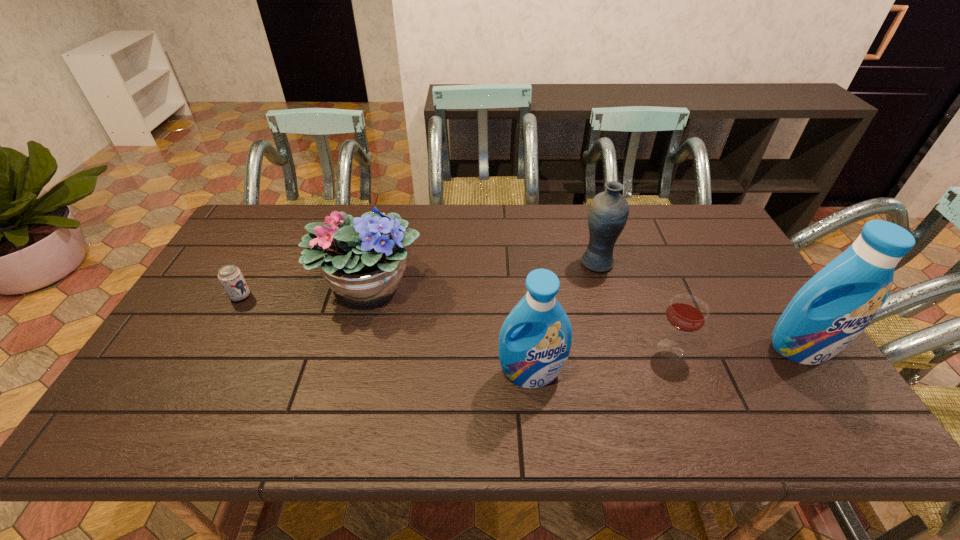
Where is `the left detergent`? This screenshot has width=960, height=540. the left detergent is located at coordinates (535, 339).

At what (x,y) coordinates should I click in order to perform the action: click on the shorter detergent. Please return your answer as a coordinate pair (x, y). This screenshot has height=540, width=960. Looking at the image, I should click on (535, 339).

The height and width of the screenshot is (540, 960). I want to click on the right detergent, so click(x=837, y=304).

This screenshot has height=540, width=960. Identify the location of the taller detergent. (837, 304).

Locate an element on the screen. bouquet is located at coordinates (363, 260).

At what (x,y) coordinates should I click in order to perform the action: click on vase. Please return your answer as a coordinate pair (x, y). Looking at the image, I should click on click(x=608, y=212).

Where is `the second shortest object`? Image resolution: width=960 pixels, height=540 pixels. the second shortest object is located at coordinates pyautogui.click(x=686, y=313).

The height and width of the screenshot is (540, 960). What are the coordinates of `the second object from right to left` in the screenshot? It's located at [x=686, y=313].

At what (x,y) coordinates should I click in order to perform the action: click on the leftmost object. Please return your answer as a coordinate pair (x, y). Looking at the image, I should click on (230, 276).

Find the location of a particular element. the shortest object is located at coordinates (230, 276).